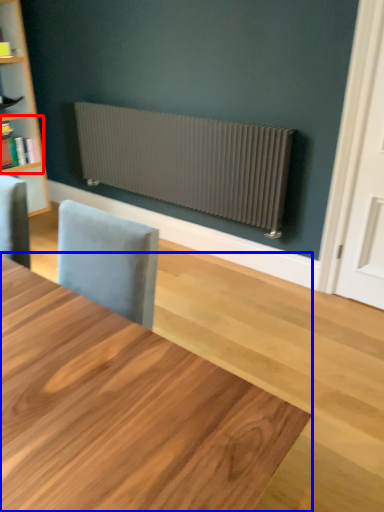
Question: Which object appears farthest to the camera in this image, shelf (highlighted by a red box) or table (highlighted by a blue box)?

Choices:
 (A) shelf
 (B) table

Answer: (A)